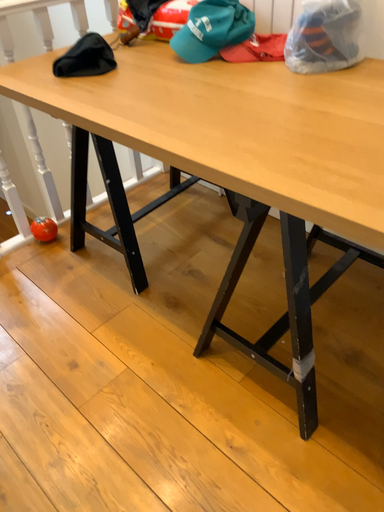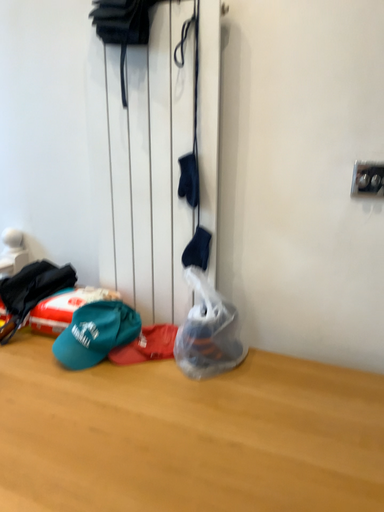
Question: How did the camera likely rotate when shooting the video?

Choices:
 (A) rotated upward
 (B) rotated downward

Answer: (A)